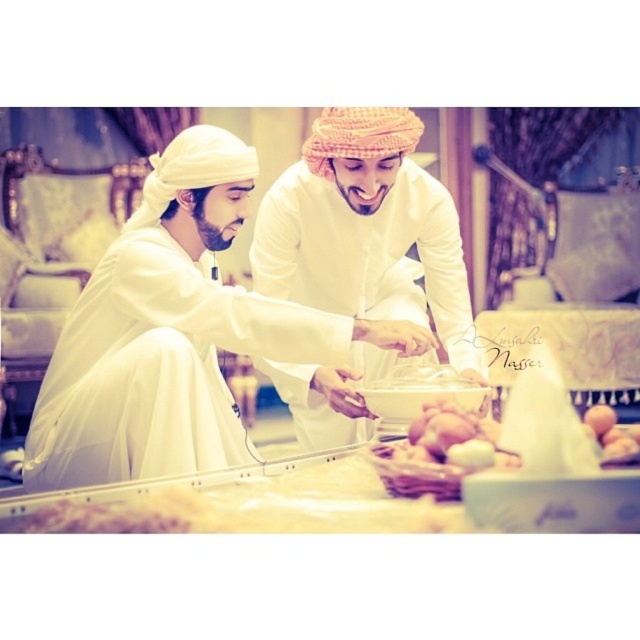
Question: Which is nearer to the white matte clothing at center?

Choices:
 (A) smooth white eggs at center
 (B) smooth white bread at lower right

Answer: (A)

Question: Is smooth white eggs at center positioned in front of smooth white bread at lower right?

Choices:
 (A) no
 (B) yes

Answer: (A)

Question: Which object is closer to the camera taking this photo?

Choices:
 (A) white matte clothing at center
 (B) white matte/soft fabric at center
 (C) smooth white bread at lower right
 (D) smooth white eggs at center

Answer: (C)

Question: Considering the real-world distances, which object is closest to the white matte/soft fabric at center?

Choices:
 (A) white matte clothing at center
 (B) smooth white eggs at center

Answer: (A)

Question: Can you confirm if white matte/soft fabric at center is bigger than smooth white eggs at center?

Choices:
 (A) yes
 (B) no

Answer: (A)

Question: Is white matte/soft fabric at center further to the viewer compared to smooth white eggs at center?

Choices:
 (A) no
 (B) yes

Answer: (B)